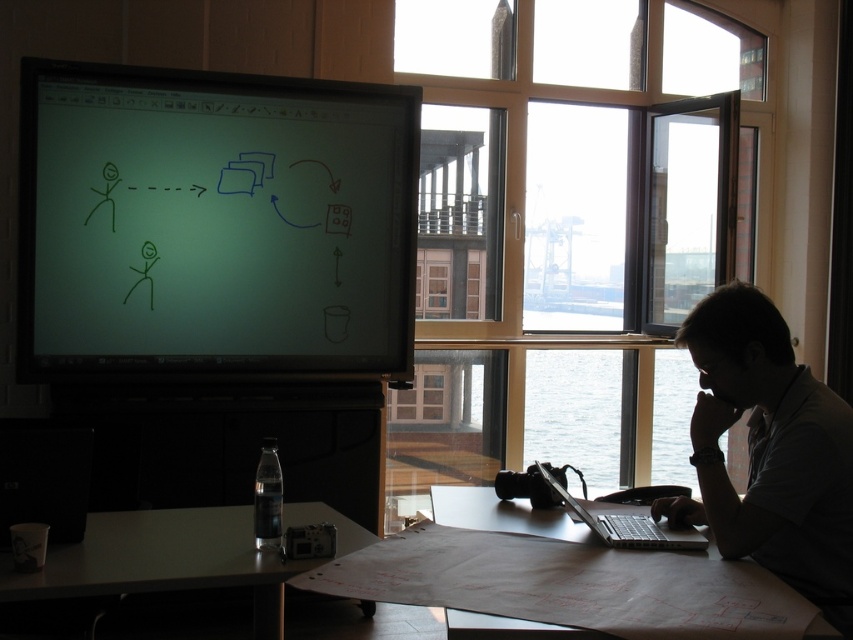
Is matte green screen at upper left smaller than white paper at lower right?

No, matte green screen at upper left is not smaller than white paper at lower right.

Does point (236, 77) come in front of point (566, 529)?

That is False.

This screenshot has width=853, height=640. Find the location of `matte green screen at upper left`. matte green screen at upper left is located at coordinates (213, 224).

The height and width of the screenshot is (640, 853). What are the coordinates of `transparent glass window at upper center` in the screenshot? It's located at (515, 93).

Between point (440, 48) and point (399, 420), which one is positioned behind?

Point (399, 420)

Where is `transparent glass window at upper center`? transparent glass window at upper center is located at coordinates (515, 93).

Consider the image. Between transparent glass window at upper center and silver metallic laptop at lower right, which one is positioned lower?

silver metallic laptop at lower right is below.

Based on the photo, is transparent glass window at upper center wider than silver metallic laptop at lower right?

Correct, the width of transparent glass window at upper center exceeds that of silver metallic laptop at lower right.

The image size is (853, 640). Describe the element at coordinates (515, 93) in the screenshot. I see `transparent glass window at upper center` at that location.

Locate an element on the screen. This screenshot has height=640, width=853. transparent glass window at upper center is located at coordinates (515, 93).